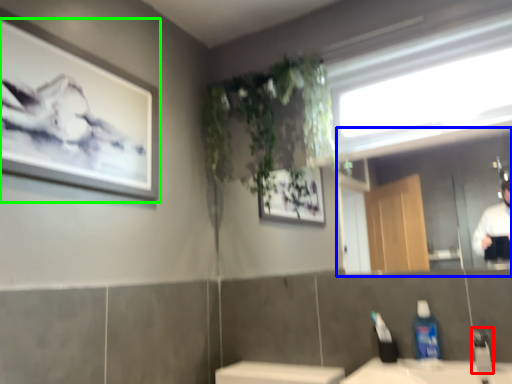
Question: Which object is the farthest from faucet (highlighted by a red box)? Choose among these: mirror (highlighted by a blue box) or picture frame (highlighted by a green box).

Choices:
 (A) mirror
 (B) picture frame

Answer: (A)